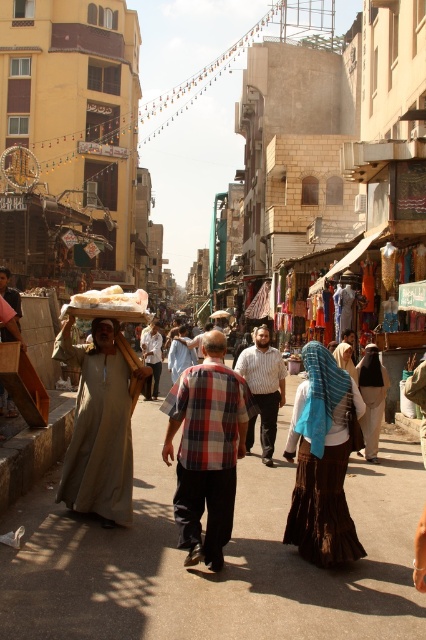
Which of these two, plaid cotton shirt at center or brown woven skirt at lower center, stands shorter?

With less height is brown woven skirt at lower center.

Describe the element at coordinates (207, 449) in the screenshot. I see `plaid cotton shirt at center` at that location.

Locate an element on the screen. This screenshot has width=426, height=640. plaid cotton shirt at center is located at coordinates (207, 449).

At what (x,y) coordinates should I click in order to perform the action: click on plaid cotton shirt at center. Please return your answer as a coordinate pair (x, y). Image resolution: width=426 pixels, height=640 pixels. Looking at the image, I should click on (207, 449).

This screenshot has width=426, height=640. In order to click on plaid cotton shirt at center in this screenshot , I will do `click(207, 449)`.

Is point (163, 458) farther from camera compared to point (109, 451)?

No, (163, 458) is in front of (109, 451).

You are a GUI agent. You are given a task and a screenshot of the screen. Output one action in this format:
    pyautogui.click(x=<x>, y=<y>)
    Task: Click on the plaid cotton shirt at center
    The image size is (426, 640).
    Given the screenshot: What is the action you would take?
    pyautogui.click(x=207, y=449)

Is point (104, 392) less distant than point (284, 401)?

Yes, it is.

Which is in front, point (89, 401) or point (258, 401)?

Point (89, 401) is more forward.

Is point (120, 449) farther from viewer compared to point (261, 436)?

No, (120, 449) is in front of (261, 436).

This screenshot has height=640, width=426. I want to click on beige cotton robe at left, so point(100,422).